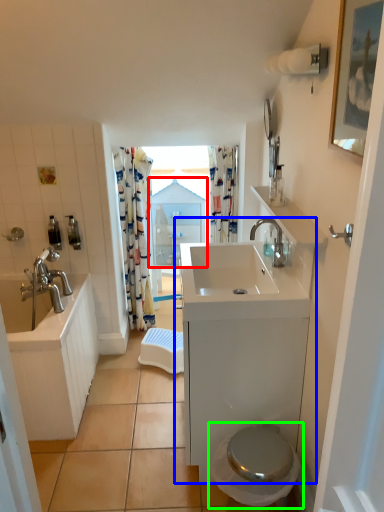
Question: Considering the real-world distances, which object is farthest from medicine cabinet (highlighted by a red box)? bathroom cabinet (highlighted by a blue box) or toilet (highlighted by a green box)?

Choices:
 (A) bathroom cabinet
 (B) toilet

Answer: (B)